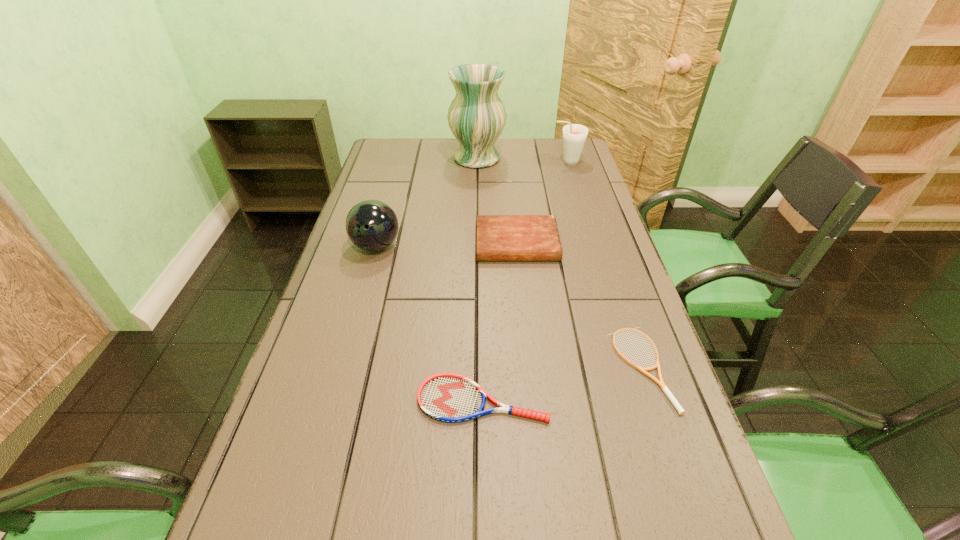
Where is `vase`? vase is located at coordinates (476, 116).

Find the location of a particular element. The image size is (960, 540). root beer is located at coordinates (574, 135).

Find the location of `bowling ball`. bowling ball is located at coordinates (371, 225).

This screenshot has height=540, width=960. I want to click on Bible, so click(x=499, y=237).

Where is `the second shortest object`? the second shortest object is located at coordinates (447, 397).

Where is `the left tennis racket`? This screenshot has height=540, width=960. the left tennis racket is located at coordinates (447, 397).

You are a GUI agent. You are given a task and a screenshot of the screen. Output one action in this format:
    pyautogui.click(x=<x>, y=<y>)
    Task: Click on the shortest object
    The height and width of the screenshot is (540, 960).
    Given the screenshot: What is the action you would take?
    click(x=661, y=383)

Find the location of a particular element. The height and width of the screenshot is (540, 960). the right tennis racket is located at coordinates (661, 383).

Locate an element on the screen. The width and height of the screenshot is (960, 540). free space located on the front of the tallest object is located at coordinates (476, 217).

I want to click on free space located 0.160m on the drink side of the root beer, so click(508, 162).